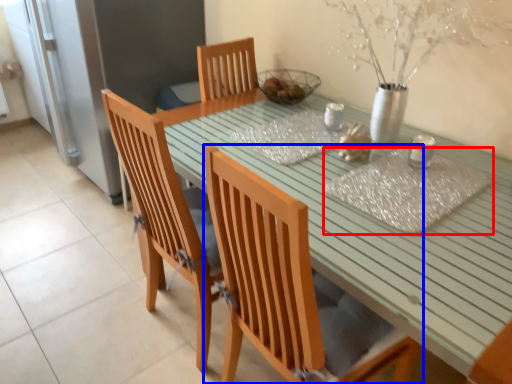
Question: Which object appears farthest to the camera in this image, place mat (highlighted by a red box) or chair (highlighted by a blue box)?

Choices:
 (A) place mat
 (B) chair

Answer: (A)